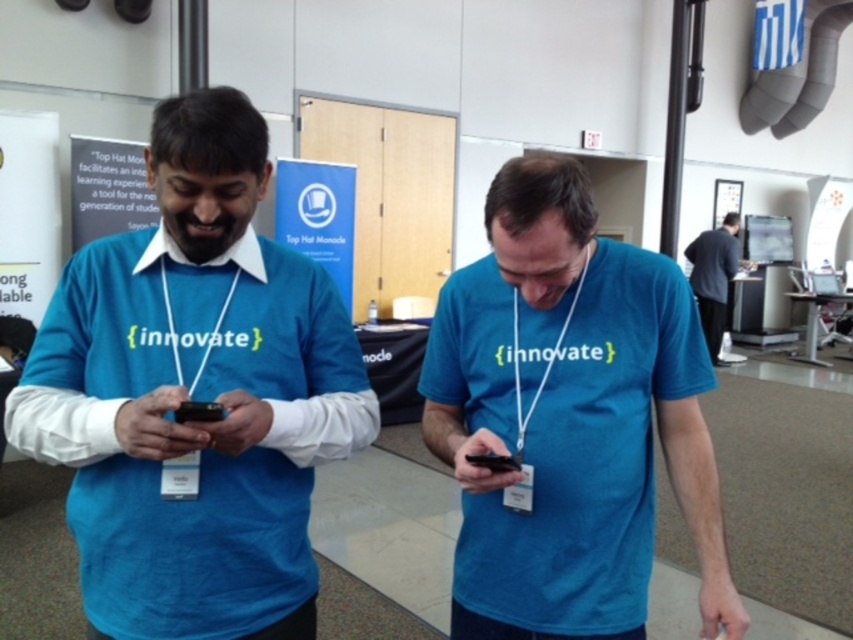
Question: Is matte white text at upper left in front of white paper at left?

Choices:
 (A) no
 (B) yes

Answer: (A)

Question: Is matte blue shirt at left positioned at the back of matte white text at upper left?

Choices:
 (A) yes
 (B) no

Answer: (B)

Question: Which point is farther from the camera taking this photo?

Choices:
 (A) (9, 262)
 (B) (213, 202)

Answer: (A)

Question: Which point is closer to the camera taking this photo?

Choices:
 (A) (206, 406)
 (B) (0, 296)
 (C) (213, 332)

Answer: (A)

Question: Among these points, which one is nearest to the camera?

Choices:
 (A) pyautogui.click(x=86, y=157)
 (B) pyautogui.click(x=189, y=419)

Answer: (B)

Question: Does matte blue shirt at left appear over matte blue t-shirt at center?

Choices:
 (A) no
 (B) yes

Answer: (A)